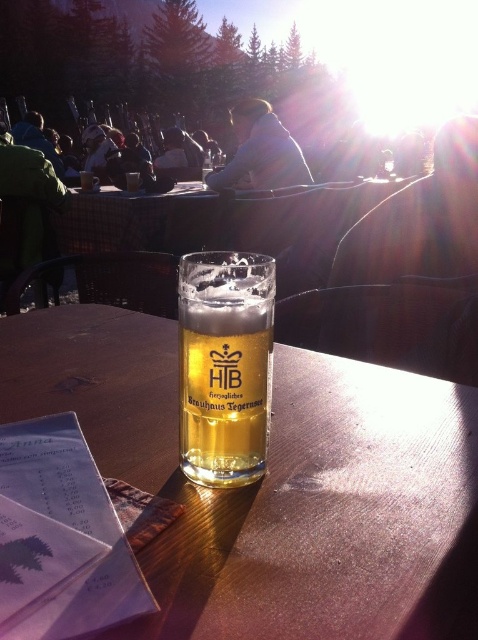
You are a waiter at the restaurant. You see the translucent glass at center and the translucent glass beer at center on the table. Which one is closer to the floor?

The translucent glass at center is closer to the floor because it is located below the translucent glass beer at center.

You are a waiter at the restaurant. You need to place a dessert plate on the table. The dessert plate is 12 inches in diameter. Can you place it on the table without overlapping the translucent glass at center and the translucent glass beer at center?

The translucent glass at center is wider than the translucent glass beer at center. However, the exact dimensions of both glasses and the table are not provided in the scene description. Therefore, it is impossible to determine if the dessert plate will fit without overlapping.